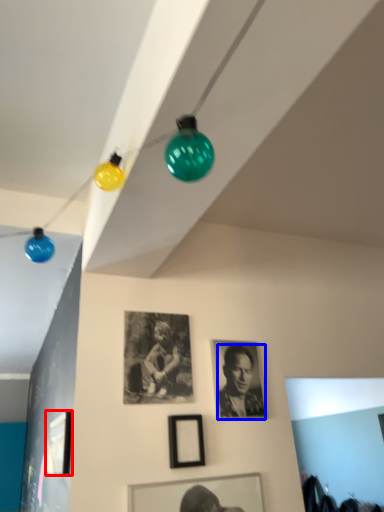
Question: Which of the following is the closest to the observer, picture frame (highlighted by a red box) or person (highlighted by a blue box)?

Choices:
 (A) picture frame
 (B) person

Answer: (A)